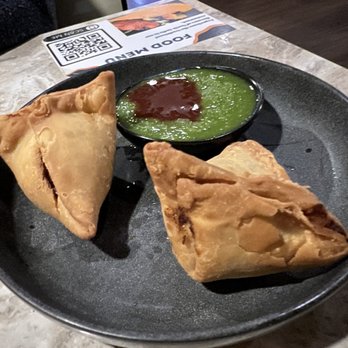
You are a GUI agent. You are given a task and a screenshot of the screen. Output one action in this format:
    pyautogui.click(x=<x>, y=<y>)
    Task: Click on the placemat lower left of plate
    The height and width of the screenshot is (348, 348).
    Given the screenshot: What is the action you would take?
    pyautogui.click(x=17, y=325)